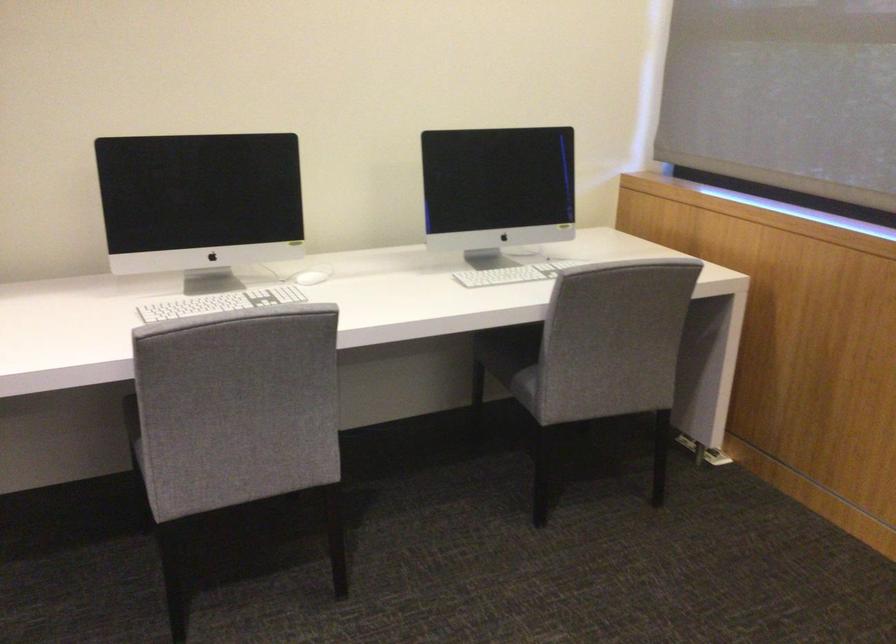
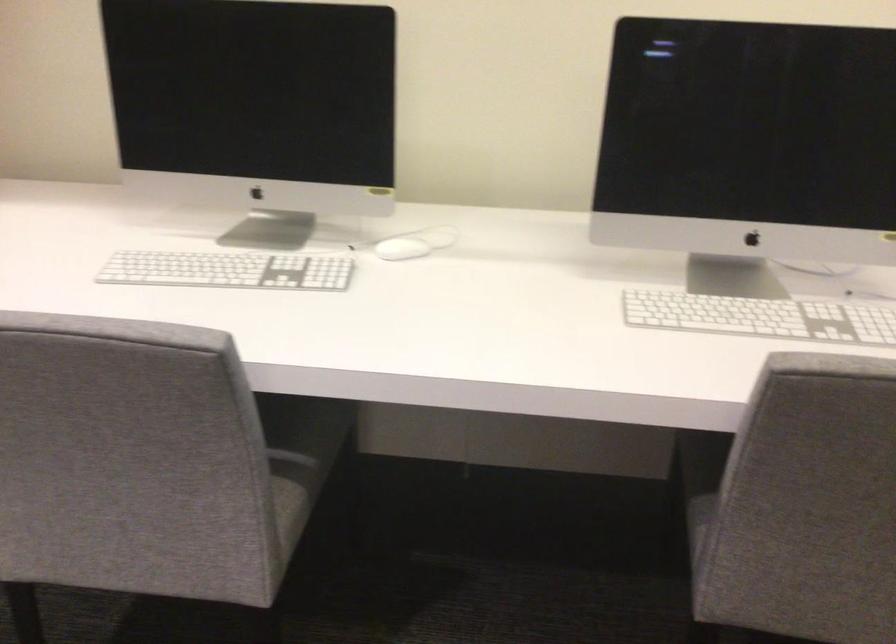
The point at (x=521, y=272) is marked in the first image. Where is the corresponding point in the second image?

(760, 317)